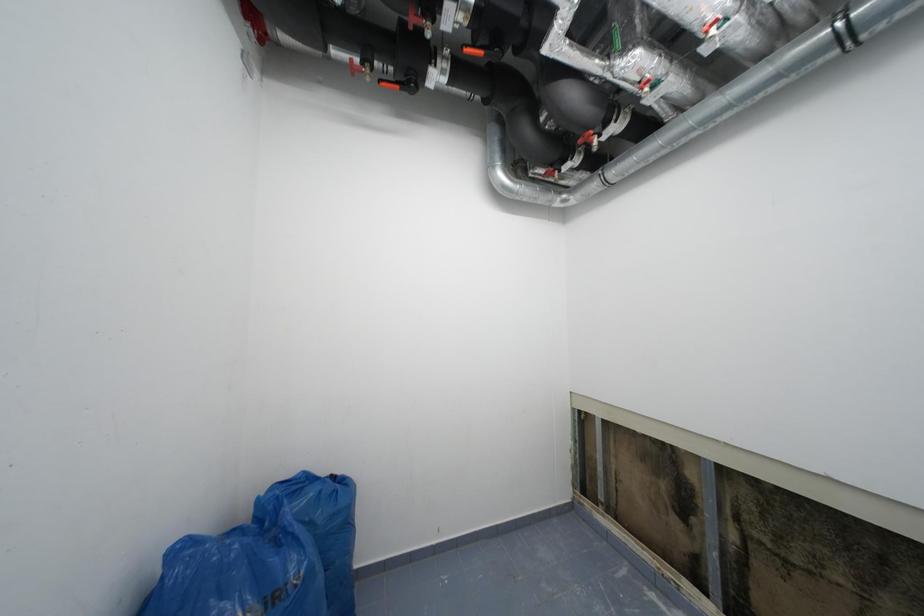
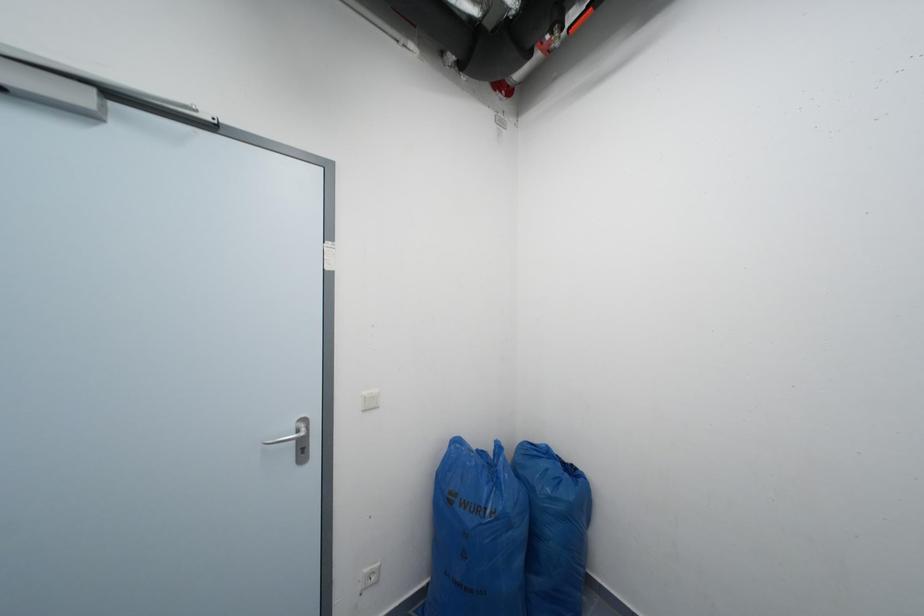
Question: The camera is either moving clockwise (left) or counter-clockwise (right) around the object. The first image is from the beginning of the video and the second image is from the end. Is the camera moving left or right when shooting the video?

Choices:
 (A) Left
 (B) Right

Answer: (B)